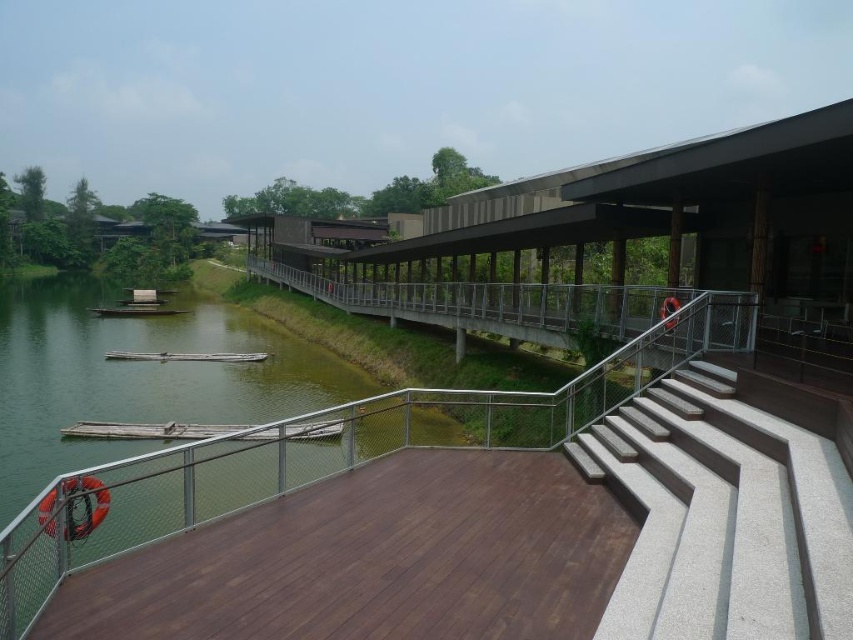
You are standing at the wooden deck and want to reach the point marked as point (204, 605). However, there is an obstacle located at point (699, 528). Based on their positions, will you encounter the obstacle before reaching your destination?

Point (204, 605) is in front of point (699, 528), so you will reach the destination before encountering the obstacle.

You are standing on the brown wood deck at lower left and want to go to the gray concrete stairs at right. Which direction should you move to reach them?

To reach the gray concrete stairs at right from the brown wood deck at lower left, you should move towards the right since the stairs are positioned to the right side of the deck.

You are a maintenance worker needing to reach the gray concrete stairs at right from the brown wood deck at lower left. Considering their heights, which structure is lower and requires climbing up to reach the other?

The brown wood deck at lower left has a lesser height compared to gray concrete stairs at right, so you need to climb up from the brown wood deck at lower left to reach the gray concrete stairs at right.